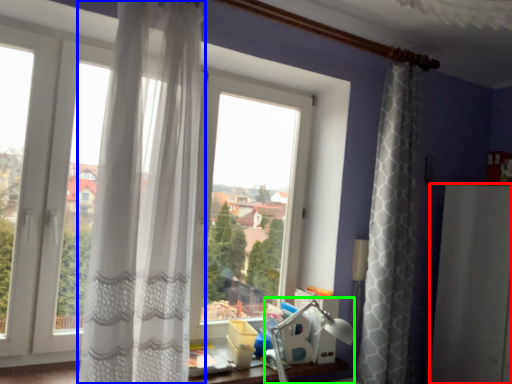
Question: Which object is the farthest from screen door (highlighted by a red box)? Choose among these: curtain (highlighted by a blue box) or table lamp (highlighted by a green box).

Choices:
 (A) curtain
 (B) table lamp

Answer: (A)